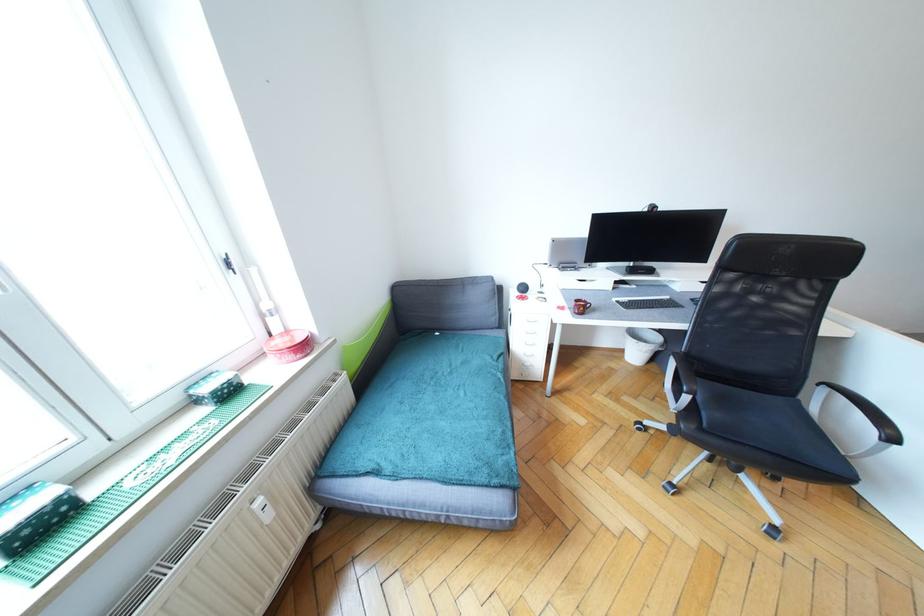
Where would you turn the radiator thermostat knob? Please return your answer as a coordinate pair (x, y).

(262, 509)